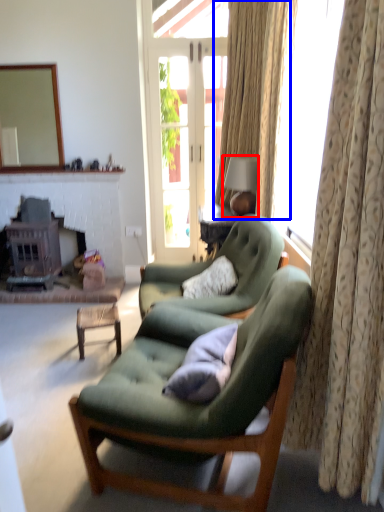
Question: Among these objects, which one is farthest to the camera, lamp (highlighted by a red box) or curtain (highlighted by a blue box)?

Choices:
 (A) lamp
 (B) curtain

Answer: (B)